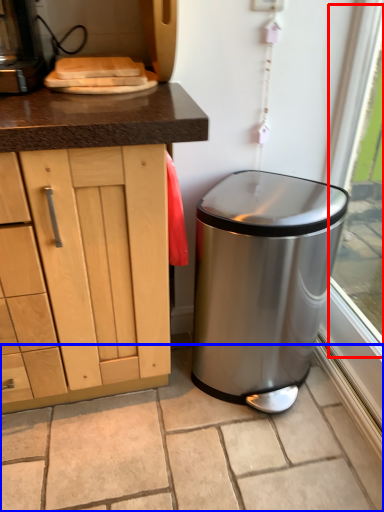
Question: Which point is closer to the camera, window screen (highlighted by a red box) or granite (highlighted by a blue box)?

Choices:
 (A) window screen
 (B) granite

Answer: (A)